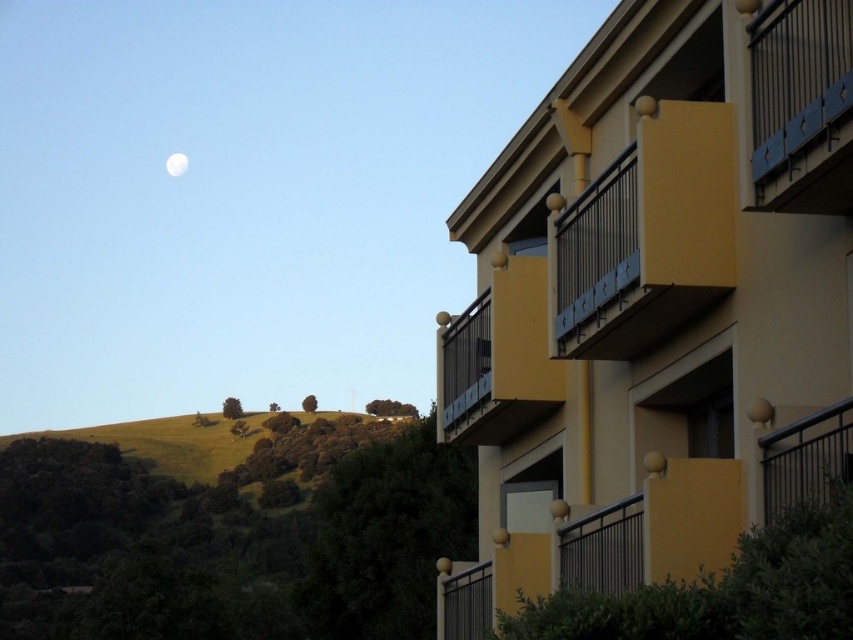
Question: Is blue painted metal railing at upper right positioned before white glossy moon at upper left?

Choices:
 (A) no
 (B) yes

Answer: (B)

Question: Based on their relative distances, which object is farther from the matte yellow balcony at upper right?

Choices:
 (A) white glossy moon at upper left
 (B) blue painted metal railing at upper right

Answer: (A)

Question: Which point is closer to the camera taking this photo?

Choices:
 (A) (834, 157)
 (B) (170, 172)

Answer: (A)

Question: Can you confirm if matte yellow balcony at upper right is smaller than blue painted metal railing at upper right?

Choices:
 (A) no
 (B) yes

Answer: (A)

Question: Which point appears closest to the camera in this image?

Choices:
 (A) (775, 81)
 (B) (593, 301)

Answer: (A)

Question: Can you confirm if matte yellow balcony at upper right is positioned to the right of white glossy moon at upper left?

Choices:
 (A) yes
 (B) no

Answer: (A)